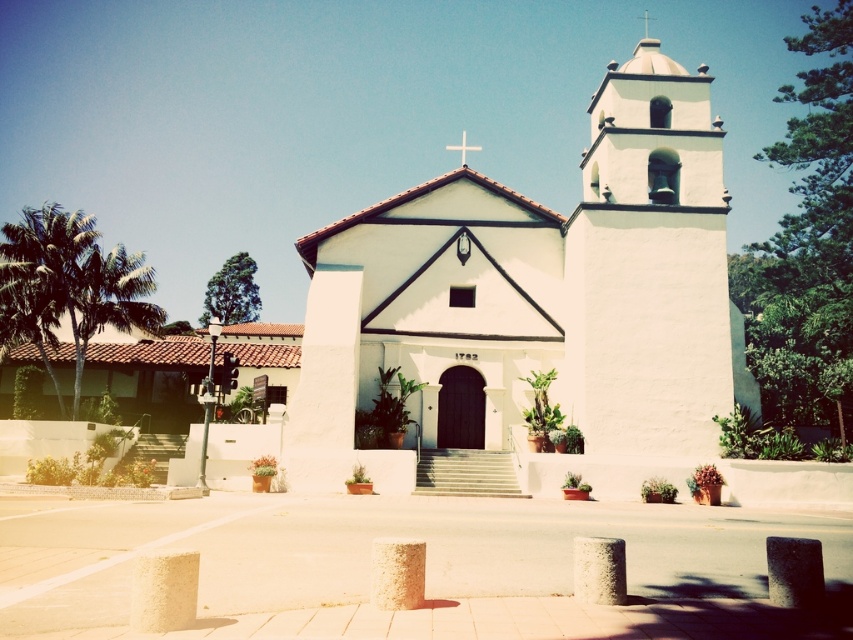
Question: Which point is closer to the camera?

Choices:
 (A) white cross at center
 (B) white stucco chapel at center

Answer: (B)

Question: Where is white stucco chapel at center located in relation to white cross at center in the image?

Choices:
 (A) below
 (B) above

Answer: (A)

Question: Which point is farther from the camera taking this photo?

Choices:
 (A) (462, 147)
 (B) (698, 316)

Answer: (A)

Question: Which object appears closest to the camera in this image?

Choices:
 (A) white cross at center
 (B) white stucco chapel at center

Answer: (B)

Question: Is white stucco chapel at center wider than white cross at center?

Choices:
 (A) yes
 (B) no

Answer: (A)

Question: Observing the image, what is the correct spatial positioning of white stucco chapel at center in reference to white cross at center?

Choices:
 (A) below
 (B) above

Answer: (A)